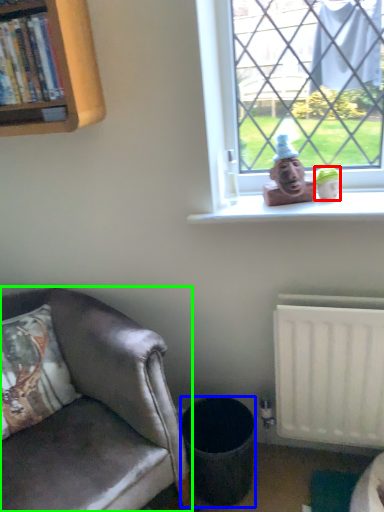
Question: Which is farther away from toy (highlighted by a red box)? trash bin/can (highlighted by a blue box) or chair (highlighted by a green box)?

Choices:
 (A) trash bin/can
 (B) chair

Answer: (B)